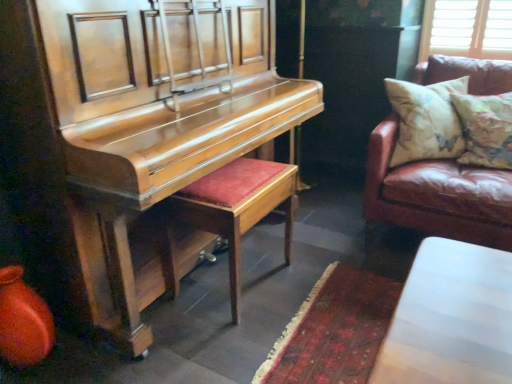
Question: Is shiny wood harpsichord at left next to leather couch at right and touching it?

Choices:
 (A) yes
 (B) no

Answer: (B)

Question: Does shiny wood harpsichord at left appear on the right side of leather couch at right?

Choices:
 (A) no
 (B) yes

Answer: (A)

Question: From the image's perspective, does shiny wood harpsichord at left appear lower than leather couch at right?

Choices:
 (A) yes
 (B) no

Answer: (A)

Question: From the image's perspective, is shiny wood harpsichord at left on top of leather couch at right?

Choices:
 (A) yes
 (B) no

Answer: (B)

Question: Is leather couch at right at the back of shiny wood harpsichord at left?

Choices:
 (A) no
 (B) yes

Answer: (A)

Question: Is shiny wood harpsichord at left positioned behind leather couch at right?

Choices:
 (A) no
 (B) yes

Answer: (A)

Question: From a real-world perspective, is leather couch at right on top of floral fabric cushion at right?

Choices:
 (A) no
 (B) yes

Answer: (A)

Question: Is leather couch at right at the left side of floral fabric cushion at right?

Choices:
 (A) no
 (B) yes

Answer: (B)

Question: Could you tell me if leather couch at right is facing floral fabric cushion at right?

Choices:
 (A) yes
 (B) no

Answer: (A)

Question: Considering the relative sizes of leather couch at right and floral fabric cushion at right in the image provided, is leather couch at right shorter than floral fabric cushion at right?

Choices:
 (A) yes
 (B) no

Answer: (B)

Question: Considering the relative positions of leather couch at right and floral fabric cushion at right in the image provided, is leather couch at right behind floral fabric cushion at right?

Choices:
 (A) no
 (B) yes

Answer: (B)

Question: From a real-world perspective, is leather couch at right physically below floral fabric cushion at right?

Choices:
 (A) no
 (B) yes

Answer: (B)

Question: Considering the relative sizes of brown leather couch at right and shiny wood harpsichord at left in the image provided, is brown leather couch at right bigger than shiny wood harpsichord at left?

Choices:
 (A) yes
 (B) no

Answer: (B)